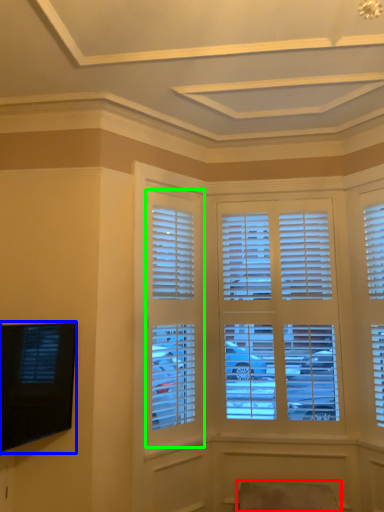
Question: Which object is positioned closest to swivel chair (highlighted by a red box)? Select from television (highlighted by a blue box) and window (highlighted by a green box).

Choices:
 (A) television
 (B) window

Answer: (B)